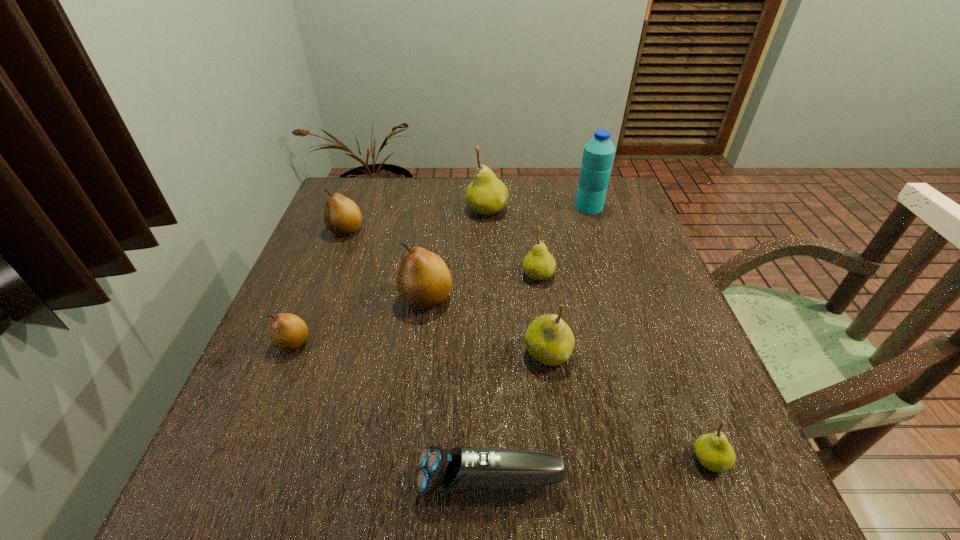
The image size is (960, 540). I want to click on free spot located 0.340m on the head of the electric shaver, so click(x=209, y=481).

What are the coordinates of `free space located on the head of the electric shaver` in the screenshot? It's located at (259, 481).

The image size is (960, 540). Identify the location of vacant area situated 0.360m on the head of the electric shaver. (197, 481).

The image size is (960, 540). In order to click on water bottle present at the far edge in this screenshot , I will do `click(598, 155)`.

Where is `pear that is at the near edge`? The width and height of the screenshot is (960, 540). pear that is at the near edge is located at coordinates (714, 452).

I want to click on electric shaver present at the near edge, so pos(462,468).

Locate an element on the screen. water bottle located in the right edge section of the desktop is located at coordinates (598, 155).

In order to click on pear present at the right edge in this screenshot , I will do `click(714, 452)`.

What are the coordinates of `object at the far left corner` in the screenshot? It's located at (342, 216).

At what (x,y) coordinates should I click in order to perform the action: click on object present at the far right corner. Please return your answer as a coordinate pair (x, y). This screenshot has width=960, height=540. Looking at the image, I should click on (598, 155).